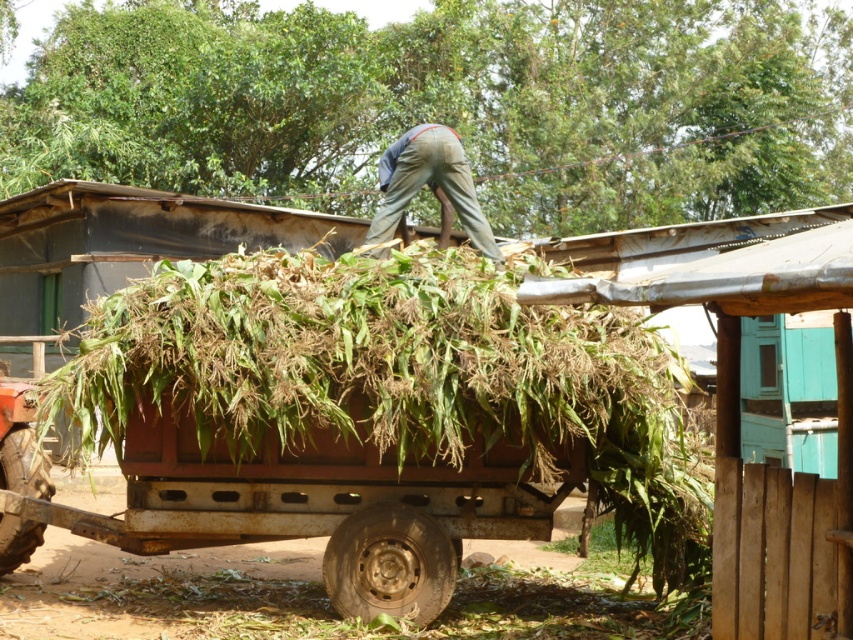
Question: Considering the real-world distances, which object is farthest from the rusty metal wagon at center?

Choices:
 (A) green leafy hay at center
 (B) khaki pants at center

Answer: (B)

Question: Which of these objects is positioned closest to the khaki pants at center?

Choices:
 (A) rusty metal wagon at center
 (B) green leafy hay at center

Answer: (B)

Question: Is rusty metal wagon at center behind khaki pants at center?

Choices:
 (A) no
 (B) yes

Answer: (A)

Question: Does rusty metal wagon at center come in front of khaki pants at center?

Choices:
 (A) no
 (B) yes

Answer: (B)

Question: Estimate the real-world distances between objects in this image. Which object is closer to the rusty metal wagon at center?

Choices:
 (A) khaki pants at center
 (B) green leafy hay at center

Answer: (B)

Question: Is green leafy hay at center bigger than rusty metal wagon at center?

Choices:
 (A) no
 (B) yes

Answer: (B)